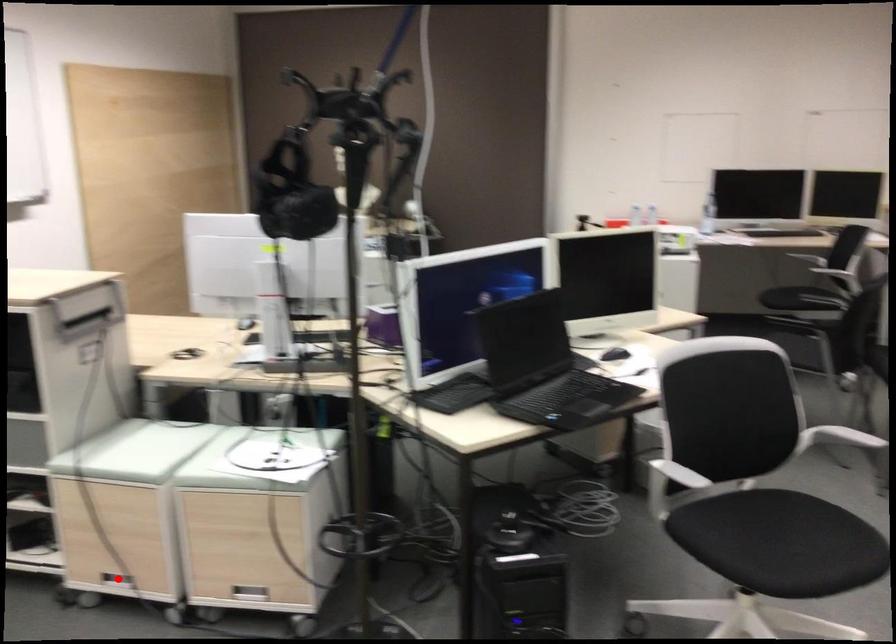
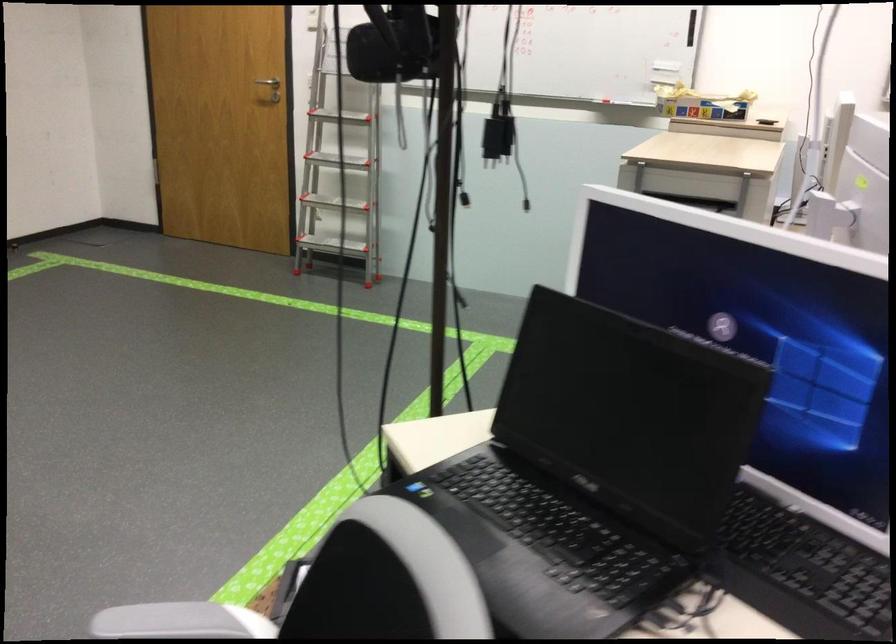
Question: I am providing you with two images of the same scene from different viewpoints. A red point is marked on the first image. Can you still see the location of the red point in image 2?

Choices:
 (A) Yes
 (B) No

Answer: (B)